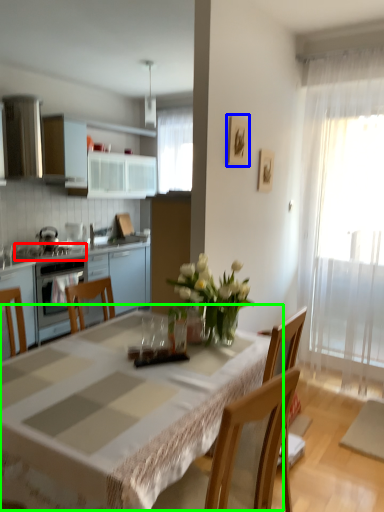
Question: Considering the real-world distances, which object is farthest from gas stove (highlighted by a red box)? picture frame (highlighted by a blue box) or table (highlighted by a green box)?

Choices:
 (A) picture frame
 (B) table

Answer: (B)